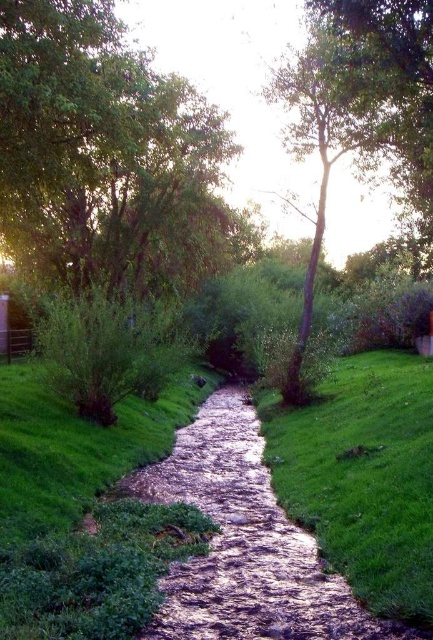
You are standing at the point with coordinates (362,476) in this scene. What do you see directly beneath your feet?

At point (362,476) lies green grassy bank at center.

You are standing at the edge of the stream in the scene and want to reach a point marked by coordinates. Which of the two points, point (362, 538) or point (232, 500), is closer to your current position?

Point (362, 538) is closer to the camera than point (232, 500), so if you are standing at the edge of the stream, point (362, 538) would be closer to your current position.

You are a gardener who wants to plant a new row of flowers between the green grassy bank at center and the shiny metallic stream at center. Which object should you avoid planting too close to based on their height?

The green grassy bank at center is much taller than the shiny metallic stream at center, so you should avoid planting too close to the green grassy bank at center to prevent the flowers from being overshadowed.